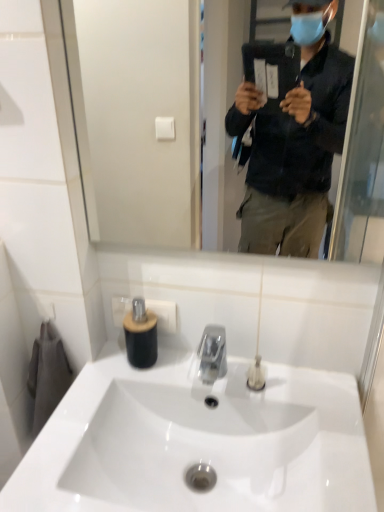
This screenshot has height=512, width=384. Find the location of `vacant space in front of clear plastic tube at center, which ranks as the 2th toiletry in left-to-right order`. vacant space in front of clear plastic tube at center, which ranks as the 2th toiletry in left-to-right order is located at coordinates (321, 448).